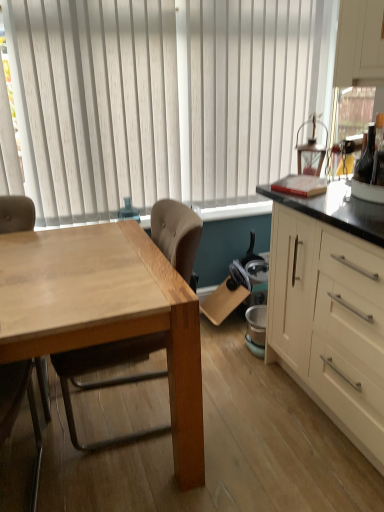
Question: Is the surface of white vertical blinds at upper center in direct contact with white matte cabinet at right?

Choices:
 (A) no
 (B) yes

Answer: (A)

Question: Considering the relative sizes of white vertical blinds at upper center and white matte cabinet at right in the image provided, is white vertical blinds at upper center bigger than white matte cabinet at right?

Choices:
 (A) yes
 (B) no

Answer: (B)

Question: From the image's perspective, is white vertical blinds at upper center beneath white matte cabinet at right?

Choices:
 (A) yes
 (B) no

Answer: (B)

Question: Considering the relative positions of white vertical blinds at upper center and white matte cabinet at right in the image provided, is white vertical blinds at upper center to the right of white matte cabinet at right from the viewer's perspective?

Choices:
 (A) yes
 (B) no

Answer: (B)

Question: Does white vertical blinds at upper center have a greater height compared to white matte cabinet at right?

Choices:
 (A) yes
 (B) no

Answer: (A)

Question: From a real-world perspective, is white vertical blinds at upper center below white matte cabinet at right?

Choices:
 (A) yes
 (B) no

Answer: (B)

Question: From a real-world perspective, is light brown wood chair at left, acting as the 2th chair starting from the left, located higher than white matte cabinet at right?

Choices:
 (A) yes
 (B) no

Answer: (B)

Question: Considering the relative sizes of light brown wood chair at left, acting as the 2th chair starting from the left, and white matte cabinet at right in the image provided, is light brown wood chair at left, acting as the 2th chair starting from the left, thinner than white matte cabinet at right?

Choices:
 (A) no
 (B) yes

Answer: (B)

Question: Considering the relative sizes of light brown wood chair at left, acting as the 2th chair starting from the left, and white matte cabinet at right in the image provided, is light brown wood chair at left, acting as the 2th chair starting from the left, shorter than white matte cabinet at right?

Choices:
 (A) no
 (B) yes

Answer: (B)

Question: Could you tell me if light brown wood chair at left, acting as the first chair starting from the right, is turned towards white matte cabinet at right?

Choices:
 (A) no
 (B) yes

Answer: (A)

Question: Can you confirm if light brown wood chair at left, acting as the 2th chair starting from the left, is taller than white matte cabinet at right?

Choices:
 (A) no
 (B) yes

Answer: (A)

Question: Is light brown wood chair at left, acting as the 2th chair starting from the left, to the right of white matte cabinet at right from the viewer's perspective?

Choices:
 (A) yes
 (B) no

Answer: (B)

Question: Is white matte cabinet at right positioned with its back to light brown wood chair at left, acting as the 2th chair starting from the left?

Choices:
 (A) no
 (B) yes

Answer: (A)